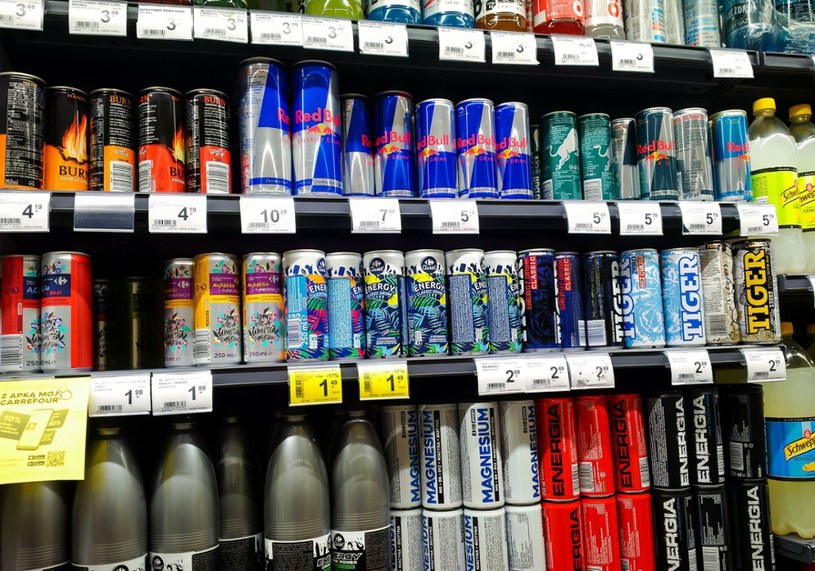
The width and height of the screenshot is (815, 571). Identify the location of white cans on the bottom shelf. (407, 485), (412, 528), (451, 533), (447, 472), (483, 477), (500, 554), (521, 544), (518, 471).